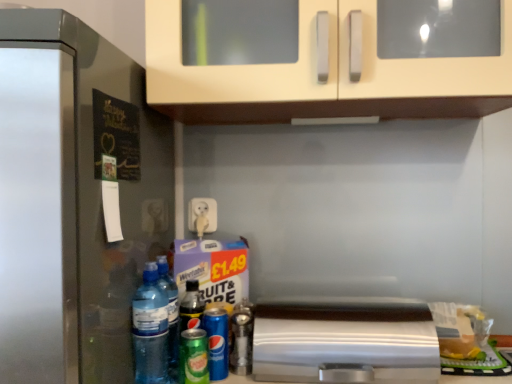
Measure the distance between satin silver refrigerator at left and camera.

A distance of 23.42 inches exists between satin silver refrigerator at left and camera.

You are a GUI agent. You are given a task and a screenshot of the screen. Output one action in this format:
    pyautogui.click(x=<x>, y=<y>)
    Task: Click on the translucent plastic water bottle at lower left, which ranks as the 3th bottle in right-to-left order
    The height and width of the screenshot is (384, 512).
    Given the screenshot: What is the action you would take?
    pyautogui.click(x=150, y=329)

What do you see at coordinates (345, 341) in the screenshot? I see `satin silver toaster at lower center` at bounding box center [345, 341].

You are a GUI agent. You are given a task and a screenshot of the screen. Output one action in this format:
    pyautogui.click(x=<x>, y=<y>)
    Task: Click on the satin silver refrigerator at left
    Image resolution: width=512 pixels, height=384 pixels.
    Given the screenshot: What is the action you would take?
    pyautogui.click(x=68, y=203)

The width and height of the screenshot is (512, 384). There is a satin silver refrigerator at left. Find the location of `the 2nd bottle below it (from a real-world perspective)`. the 2nd bottle below it (from a real-world perspective) is located at coordinates (170, 316).

Who is smaller, satin silver refrigerator at left or transparent plastic bottle at lower left, which appears as the second bottle when viewed from the front?

Smaller between the two is transparent plastic bottle at lower left, which appears as the second bottle when viewed from the front.

From the image's perspective, is satin silver refrigerator at left below transparent plastic bottle at lower left, the 2th bottle from the left?

No, from the image's perspective, satin silver refrigerator at left is not below transparent plastic bottle at lower left, the 2th bottle from the left.

From the image's perspective, which is below, blue metallic can at lower center, the first beer viewed from the back, or green matte can at lower center, which is the 2th beer in back-to-front order?

green matte can at lower center, which is the 2th beer in back-to-front order.

Considering the positions of point (221, 311) and point (202, 339), is point (221, 311) closer or farther from the camera than point (202, 339)?

Point (221, 311) appears to be farther away from the viewer than point (202, 339).

Is blue metallic can at lower center, the second beer from the front, far away from green matte can at lower center, positioned as the 1th beer in front-to-back order?

No, blue metallic can at lower center, the second beer from the front, is not far from green matte can at lower center, positioned as the 1th beer in front-to-back order.

The image size is (512, 384). I want to click on beer on the left of blue metallic can at lower center, the first beer viewed from the back, so click(x=194, y=357).

Considering the relative sizes of satin silver toaster at lower center and green matte can at lower center, which is the 2th beer in back-to-front order, in the image provided, is satin silver toaster at lower center shorter than green matte can at lower center, which is the 2th beer in back-to-front order,?

No.

Between point (398, 338) and point (200, 373), which one is positioned behind?

Point (398, 338)

Is satin silver toaster at lower center in front of or behind green matte can at lower center, which is the 2th beer in back-to-front order, in the image?

satin silver toaster at lower center is positioned closer to the viewer than green matte can at lower center, which is the 2th beer in back-to-front order.

Which is behind, point (208, 380) or point (234, 319)?

The point (234, 319) is behind.

Consider the image. Which object is positioned more to the left, green matte can at lower center, which is the 2th beer in back-to-front order, or metallic silver spray can at center, which appears as the first bottle when viewed from the back?

From the viewer's perspective, green matte can at lower center, which is the 2th beer in back-to-front order, appears more on the left side.

Considering the sizes of green matte can at lower center, which is the 2th beer in back-to-front order, and metallic silver spray can at center, which appears as the first bottle when viewed from the back, in the image, is green matte can at lower center, which is the 2th beer in back-to-front order, wider or thinner than metallic silver spray can at center, which appears as the first bottle when viewed from the back,?

→ Considering their sizes, green matte can at lower center, which is the 2th beer in back-to-front order, looks broader than metallic silver spray can at center, which appears as the first bottle when viewed from the back.

Is metallic silver spray can at center, which appears as the first bottle when viewed from the back, a part of green matte can at lower center, which is the 2th beer in back-to-front order?

That's incorrect, metallic silver spray can at center, which appears as the first bottle when viewed from the back, is not inside green matte can at lower center, which is the 2th beer in back-to-front order.

The image size is (512, 384). Identify the location of the 2nd bottle counting from the right of the translucent plastic water bottle at lower left, which ranks as the 3th bottle in right-to-left order. (241, 338).

Is translucent plastic water bottle at lower left, marked as the first bottle in a left-to-right arrangement, positioned with its back to metallic silver spray can at center, which appears as the first bottle when viewed from the back?

No, translucent plastic water bottle at lower left, marked as the first bottle in a left-to-right arrangement, is not facing the opposite direction of metallic silver spray can at center, which appears as the first bottle when viewed from the back.

From the picture: Is translucent plastic water bottle at lower left, which is the first bottle in front-to-back order, bigger or smaller than metallic silver spray can at center, arranged as the 1th bottle when viewed from the right?

Clearly, translucent plastic water bottle at lower left, which is the first bottle in front-to-back order, is larger in size than metallic silver spray can at center, arranged as the 1th bottle when viewed from the right.

From the image's perspective, which is below, translucent plastic water bottle at lower left, which ranks as the 3th bottle in right-to-left order, or metallic silver spray can at center, the 3th bottle in the left-to-right sequence?

metallic silver spray can at center, the 3th bottle in the left-to-right sequence, from the image's perspective.

Is the position of translucent plastic water bottle at lower left, which is the first bottle in front-to-back order, less distant than that of green matte can at lower center, which is the 2th beer in back-to-front order?

Yes, translucent plastic water bottle at lower left, which is the first bottle in front-to-back order, is closer to the viewer.

Locate an element on the screen. the 1st beer behind the translucent plastic water bottle at lower left, marked as the first bottle in a left-to-right arrangement is located at coordinates (194, 357).

Can you confirm if translucent plastic water bottle at lower left, which is the first bottle in front-to-back order, is thinner than green matte can at lower center, positioned as the 1th beer in front-to-back order?

No, translucent plastic water bottle at lower left, which is the first bottle in front-to-back order, is not thinner than green matte can at lower center, positioned as the 1th beer in front-to-back order.

In terms of height, does translucent plastic water bottle at lower left, marked as the first bottle in a left-to-right arrangement, look taller or shorter compared to green matte can at lower center, which is the 2th beer in back-to-front order?

Considering their sizes, translucent plastic water bottle at lower left, marked as the first bottle in a left-to-right arrangement, has more height than green matte can at lower center, which is the 2th beer in back-to-front order.

How much distance is there between satin silver toaster at lower center and blue metallic can at lower center, the first beer viewed from the back?

The distance of satin silver toaster at lower center from blue metallic can at lower center, the first beer viewed from the back, is 10.69 inches.

Between satin silver toaster at lower center and blue metallic can at lower center, the second beer from the front, which one has less height?

satin silver toaster at lower center.

Based on the photo, can you confirm if satin silver toaster at lower center is bigger than blue metallic can at lower center, the second beer from the front?

Yes.

Is blue metallic can at lower center, the second beer from the front, a part of satin silver toaster at lower center?

Definitely not — blue metallic can at lower center, the second beer from the front, is not inside satin silver toaster at lower center.

The image size is (512, 384). Identify the location of refrigerator positioned vertically above the transparent plastic bottle at lower left, the 2th bottle from the left (from a real-world perspective). (68, 203).

At what (x,y) coordinates should I click in order to perform the action: click on beer located on the right of green matte can at lower center, positioned as the 1th beer in front-to-back order. Please return your answer as a coordinate pair (x, y). Image resolution: width=512 pixels, height=384 pixels. Looking at the image, I should click on (216, 342).

Looking at the image, which one is located closer to blue metallic can at lower center, the first beer viewed from the back, satin silver toaster at lower center or satin silver refrigerator at left?

The object closer to blue metallic can at lower center, the first beer viewed from the back, is satin silver toaster at lower center.

Based on their spatial positions, is metallic silver spray can at center, arranged as the third bottle when viewed from the front, or blue metallic can at lower center, the first beer viewed from the back, further from satin silver toaster at lower center?

blue metallic can at lower center, the first beer viewed from the back.

Considering their positions, is blue metallic can at lower center, the second beer from the front, positioned further to satin silver toaster at lower center than transparent plastic bottle at lower left, which is the second bottle from back to front?

transparent plastic bottle at lower left, which is the second bottle from back to front.

Based on their spatial positions, is satin silver refrigerator at left or translucent plastic water bottle at lower left, which ranks as the 3th bottle in right-to-left order, further from metallic silver spray can at center, arranged as the 1th bottle when viewed from the right?

satin silver refrigerator at left.

Looking at the image, which one is located further to translucent plastic water bottle at lower left, which is the first bottle in front-to-back order, transparent plastic bottle at lower left, which appears as the second bottle when viewed from the front, or satin silver toaster at lower center?

satin silver toaster at lower center.

Based on their spatial positions, is metallic silver spray can at center, the 3th bottle in the left-to-right sequence, or green matte can at lower center, positioned as the 1th beer in front-to-back order, further from transparent plastic bottle at lower left, the 2th bottle from the left?

metallic silver spray can at center, the 3th bottle in the left-to-right sequence, is further to transparent plastic bottle at lower left, the 2th bottle from the left.

Based on their spatial positions, is satin silver refrigerator at left or satin silver toaster at lower center further from translucent plastic water bottle at lower left, the third bottle from the back?

Among the two, satin silver toaster at lower center is located further to translucent plastic water bottle at lower left, the third bottle from the back.

Looking at the image, which one is located closer to transparent plastic bottle at lower left, the 2th bottle from the left, green matte can at lower center, which is the 2th beer in back-to-front order, or metallic silver spray can at center, arranged as the 1th bottle when viewed from the right?

Based on the image, green matte can at lower center, which is the 2th beer in back-to-front order, appears to be nearer to transparent plastic bottle at lower left, the 2th bottle from the left.

Find the location of a particular element. The width and height of the screenshot is (512, 384). bottle situated between blue metallic can at lower center, the second beer from the front, and satin silver toaster at lower center from left to right is located at coordinates click(x=241, y=338).

At what (x,y) coordinates should I click in order to perform the action: click on bottle between translucent plastic water bottle at lower left, which ranks as the 3th bottle in right-to-left order, and metallic silver spray can at center, arranged as the 1th bottle when viewed from the right. Please return your answer as a coordinate pair (x, y). Looking at the image, I should click on (170, 316).

In order to click on bottle situated between translucent plastic water bottle at lower left, the third bottle from the back, and blue metallic can at lower center, the second beer from the front, from left to right in this screenshot , I will do `click(170, 316)`.

Locate an element on the screen. The image size is (512, 384). bottle situated between green matte can at lower center, positioned as the 1th beer in front-to-back order, and satin silver toaster at lower center from left to right is located at coordinates (241, 338).